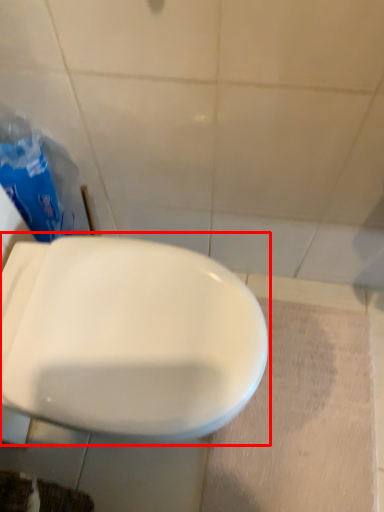
Question: From the image, what is the correct spatial relationship of toilet (annotated by the red box) in relation to garbage?

Choices:
 (A) left
 (B) right

Answer: (B)